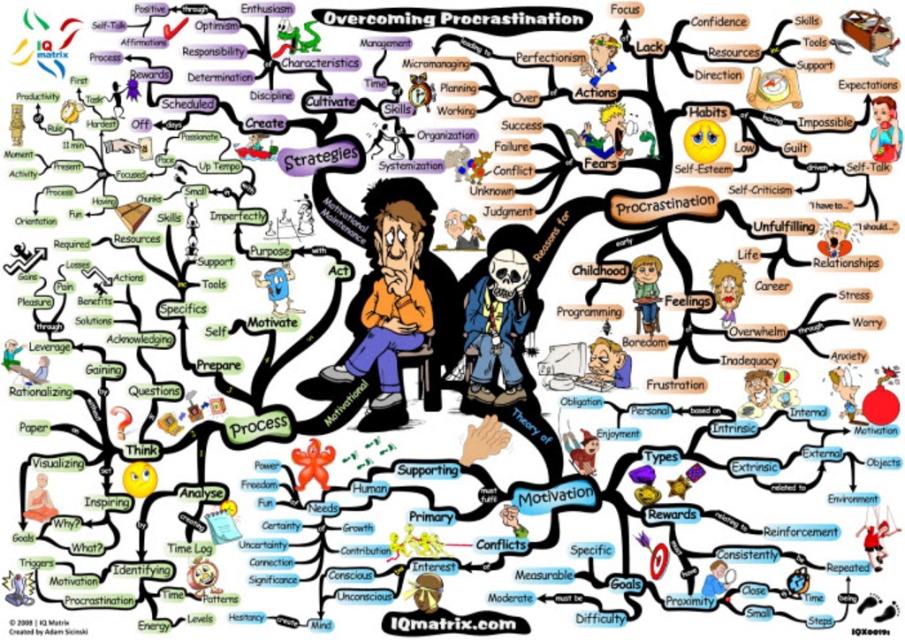
Question: Can you confirm if smooth fabric shirt at upper right is positioned below matte orange monk at lower left?

Choices:
 (A) yes
 (B) no

Answer: (B)

Question: Considering the relative positions of matte black skeleton at center and cartoon woman at center in the image provided, where is matte black skeleton at center located with respect to cartoon woman at center?

Choices:
 (A) above
 (B) below

Answer: (B)

Question: Which point is farther to the camera?

Choices:
 (A) wooden chair at center
 (B) orange shirt at center
 (C) smooth fabric shirt at upper right

Answer: (B)

Question: Is orange shirt at center thinner than smooth fabric shirt at upper right?

Choices:
 (A) no
 (B) yes

Answer: (A)

Question: Which point is farther from the camera taking this photo?

Choices:
 (A) (642, 262)
 (B) (377, 356)
 (C) (483, 280)

Answer: (B)

Question: Which object is closer to the camera taking this photo?

Choices:
 (A) cartoon woman at center
 (B) smooth fabric shirt at upper right
 (C) orange shirt at center

Answer: (B)